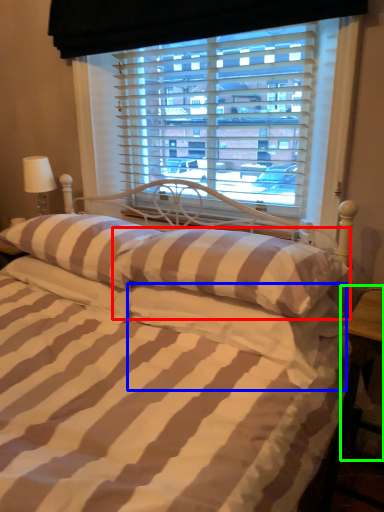
Question: Estimate the real-world distances between objects in this image. Which object is farther from pillow (highlighted by a red box), pillow (highlighted by a blue box) or table (highlighted by a green box)?

Choices:
 (A) pillow
 (B) table

Answer: (B)